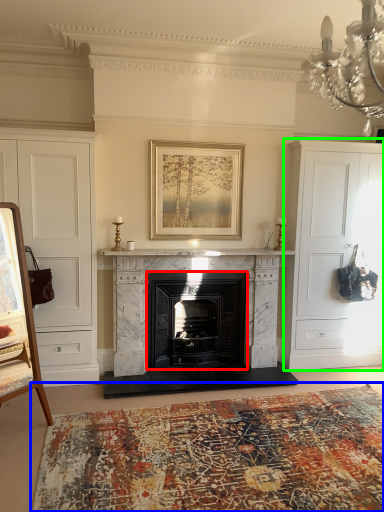
Question: Estimate the real-world distances between objects in this image. Which object is closer to fireplace (highlighted by a red box), plain (highlighted by a blue box) or cabinetry (highlighted by a green box)?

Choices:
 (A) plain
 (B) cabinetry

Answer: (B)